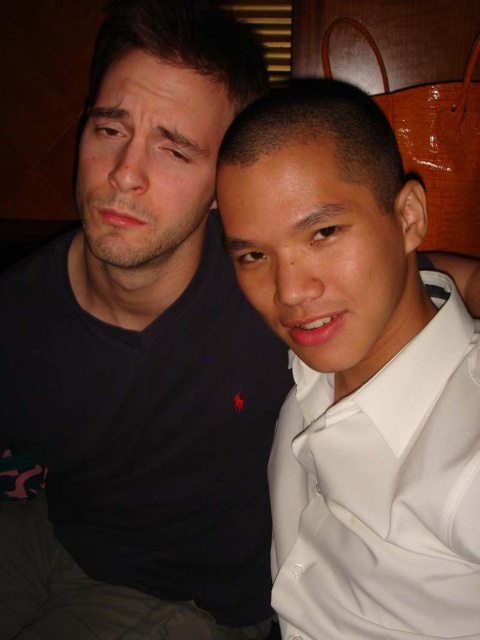
You are a photographer setting up a shoot in this scene. You need to place a light source to the left of both the black matte shirt at left and the white satin dress shirt at right. Is this possible given their positions?

The black matte shirt at left is to the left of the white satin dress shirt at right. Therefore, placing a light source to the left of both would require positioning it further left than the black matte shirt at left, which is already the leftmost object between them. This is possible as long as there is space available to the left of the black matte shirt at left.

You are a photographer setting up a portrait shoot. You need to position two subjects so that their shirts are exactly 10 inches apart. The scene shows the black matte shirt at left and white satin dress shirt at right. Are the shirts currently positioned correctly for your shoot?

The black matte shirt at left and white satin dress shirt at right are 9.95 inches apart from each other, which is just slightly less than the required 10 inches. They are almost correct but need to be moved about 0.05 inches further apart to meet the exact requirement.

You are a photographer setting up a shoot in the scene described. You need to place a small light source between the black matte shirt at left and the white satin dress shirt at right. Based on their positions, where should you position the light source?

The light source should be placed above the white satin dress shirt at right because the black matte shirt at left is above it, so positioning the light above the lower shirt would ensure proper illumination.